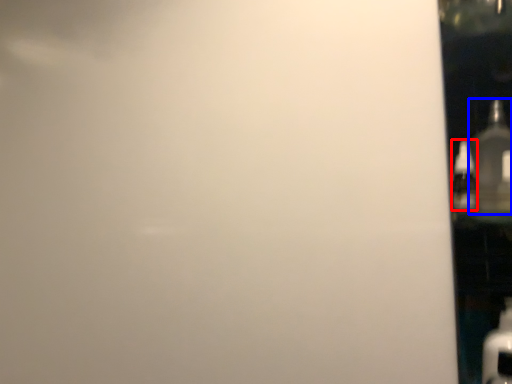
Question: Which object appears farthest to the camera in this image, bottle (highlighted by a red box) or bottle (highlighted by a blue box)?

Choices:
 (A) bottle
 (B) bottle

Answer: (A)